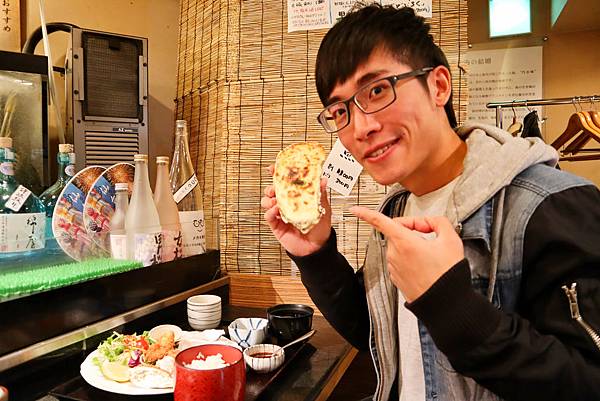
I want to click on fish tank, so click(25, 117).